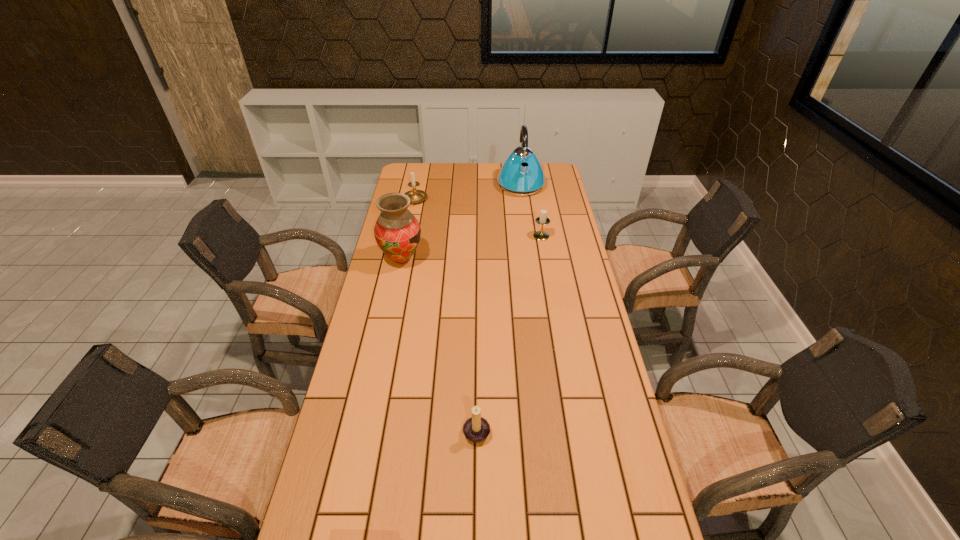
This screenshot has height=540, width=960. In order to click on free spot that satisfies the following two spatial constraints: 1. at the spout of the second farthest candle holder; 2. on the left side of the kettle in this screenshot , I will do `click(528, 236)`.

Locate an element on the screen. vacant space that satisfies the following two spatial constraints: 1. at the spout of the kettle; 2. on the wick of the nearest object is located at coordinates (554, 429).